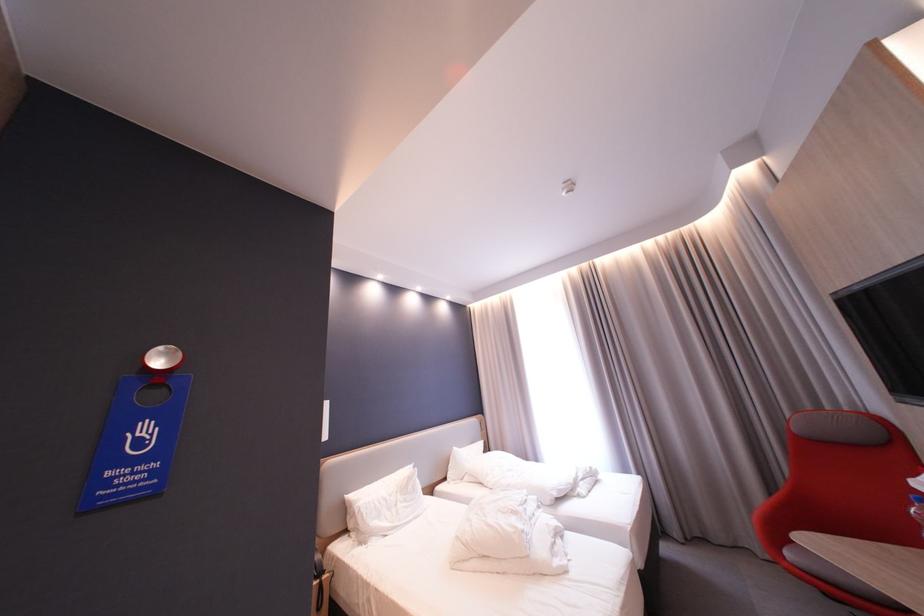
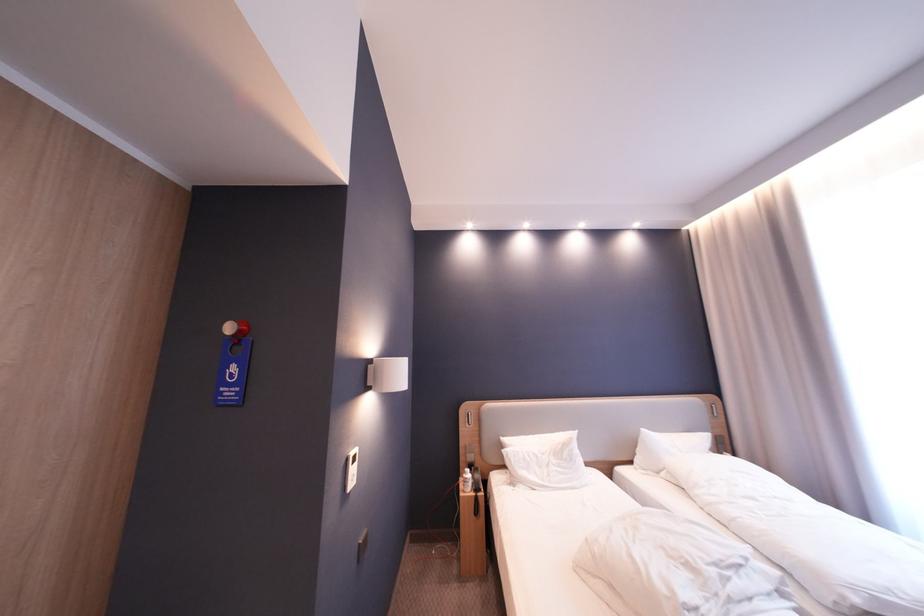
Locate, in the second image, the point that corresponds to [398,499] in the first image.

(550, 456)